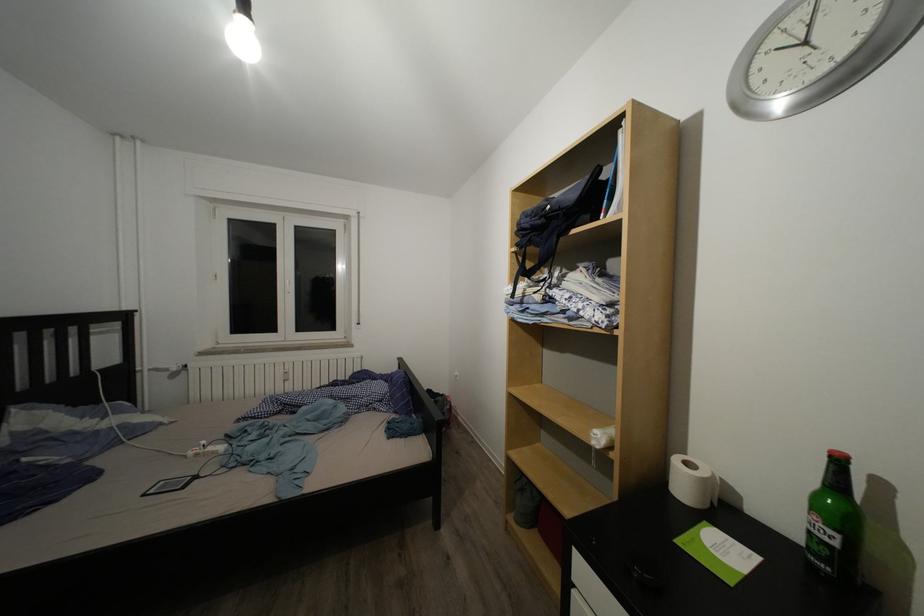
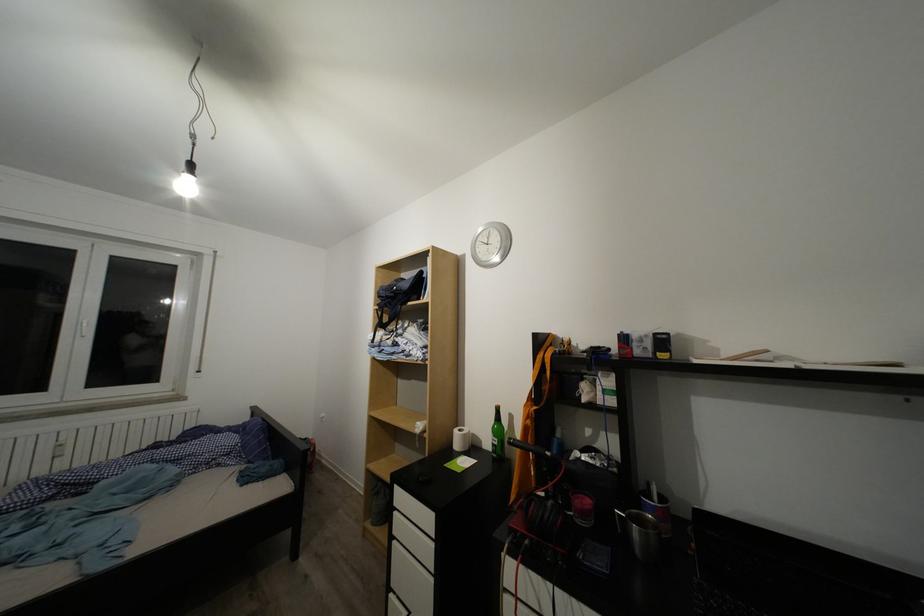
In the second image, find the point that corresponds to pixel 844 551 in the first image.

(504, 450)